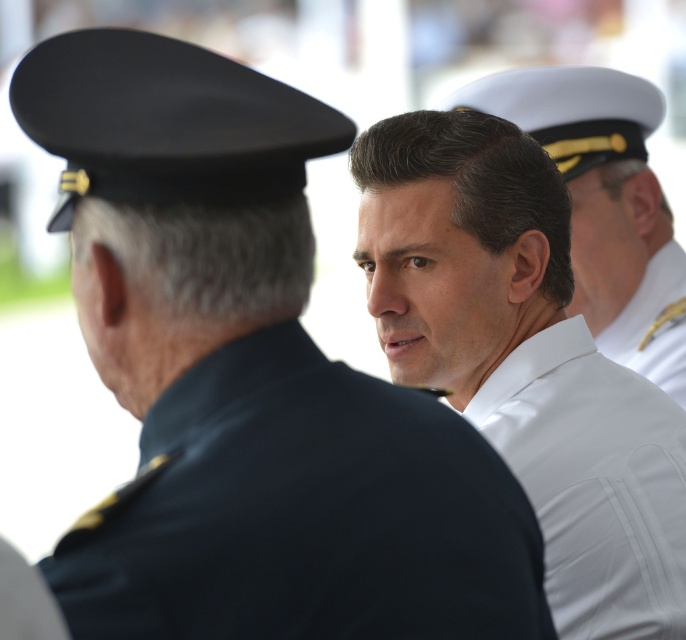
Describe the element at coordinates (593, 481) in the screenshot. The image size is (686, 640). I see `white smooth shirt at center` at that location.

This screenshot has height=640, width=686. I want to click on white smooth shirt at center, so click(x=593, y=481).

Who is more forward, (591, 605) or (661, 332)?

Point (591, 605) is in front.

Where is `white smooth shirt at center`? This screenshot has width=686, height=640. white smooth shirt at center is located at coordinates (593, 481).

Does white smooth uniform at center come behind white smooth shirt at center?

Yes.

Who is more distant from viewer, (473, 164) or (637, 579)?

Positioned behind is point (473, 164).

Find the location of `white smooth uniform at center`. white smooth uniform at center is located at coordinates (523, 358).

Does white smooth uniform at center have a lesser height compared to white glossy uniform at center?

In fact, white smooth uniform at center may be taller than white glossy uniform at center.

Between white smooth uniform at center and white glossy uniform at center, which one is positioned higher?

white glossy uniform at center is above.

The image size is (686, 640). What are the coordinates of `white smooth uniform at center` in the screenshot? It's located at (523, 358).